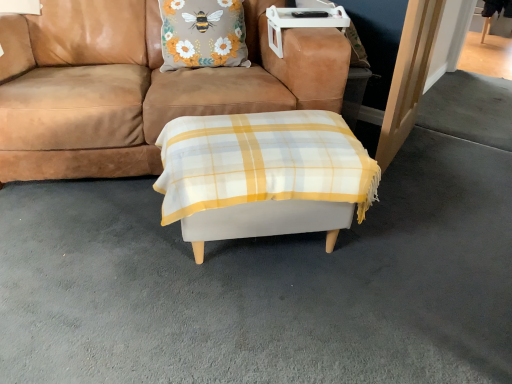
This screenshot has height=384, width=512. Describe the element at coordinates (138, 86) in the screenshot. I see `brown suede couch at center` at that location.

Where is `floral fabric pillow at upper center`? The width and height of the screenshot is (512, 384). floral fabric pillow at upper center is located at coordinates (202, 33).

Describe the element at coordinates (202, 33) in the screenshot. I see `floral fabric pillow at upper center` at that location.

The height and width of the screenshot is (384, 512). Identify the location of brown suede couch at center. (138, 86).

Considering the sizes of objects brown suede couch at center and floral fabric pillow at upper center in the image provided, who is thinner, brown suede couch at center or floral fabric pillow at upper center?

With smaller width is floral fabric pillow at upper center.

Is brown suede couch at center next to floral fabric pillow at upper center?

There is a gap between brown suede couch at center and floral fabric pillow at upper center.

Considering the sizes of brown suede couch at center and floral fabric pillow at upper center in the image, is brown suede couch at center taller or shorter than floral fabric pillow at upper center?

brown suede couch at center is taller than floral fabric pillow at upper center.

Which of these two, brown suede couch at center or white fabric ottoman at center, is bigger?

brown suede couch at center.

Is brown suede couch at center closer to the viewer compared to white fabric ottoman at center?

→ That is False.

Which of these two, brown suede couch at center or white fabric ottoman at center, stands taller?

brown suede couch at center is taller.

From a real-world perspective, is brown suede couch at center over white fabric ottoman at center?

Yes, from a real-world perspective, brown suede couch at center is on top of white fabric ottoman at center.

From the image's perspective, between floral fabric pillow at upper center and brown suede couch at center, which one is located above?

floral fabric pillow at upper center.

Is brown suede couch at center located within floral fabric pillow at upper center?

Actually, brown suede couch at center is outside floral fabric pillow at upper center.

This screenshot has height=384, width=512. Find the location of `pillow above the brown suede couch at center (from a real-world perspective)`. pillow above the brown suede couch at center (from a real-world perspective) is located at coordinates (202, 33).

Is floral fabric pillow at upper center aimed at brown suede couch at center?

Yes, floral fabric pillow at upper center is turned towards brown suede couch at center.

Is point (184, 26) farther from camera compared to point (271, 117)?

Yes, it is behind point (271, 117).

Does floral fabric pillow at upper center touch white fabric ottoman at center?

No, floral fabric pillow at upper center is not making contact with white fabric ottoman at center.

Does floral fabric pillow at upper center have a larger size compared to white fabric ottoman at center?

Actually, floral fabric pillow at upper center might be smaller than white fabric ottoman at center.

Which object is positioned more to the right, floral fabric pillow at upper center or white fabric ottoman at center?

Positioned to the right is white fabric ottoman at center.

Is point (215, 126) in front of point (187, 10)?

Yes, point (215, 126) is closer to viewer.

Is white fabric ottoman at center in contact with floral fabric pillow at upper center?

No, white fabric ottoman at center is not with floral fabric pillow at upper center.

Where is `table below the floral fabric pillow at upper center (from a real-world perspective)`? The width and height of the screenshot is (512, 384). table below the floral fabric pillow at upper center (from a real-world perspective) is located at coordinates (263, 176).

Is brown suede couch at center a part of white fabric ottoman at center?

No, white fabric ottoman at center does not contain brown suede couch at center.

This screenshot has width=512, height=384. There is a white fabric ottoman at center. Identify the location of studio couch above it (from a real-world perspective). (138, 86).

From a real-world perspective, who is located higher, white fabric ottoman at center or brown suede couch at center?

brown suede couch at center, from a real-world perspective.

Between white fabric ottoman at center and brown suede couch at center, which one has larger width?

With larger width is brown suede couch at center.

I want to click on studio couch to the left of floral fabric pillow at upper center, so click(x=138, y=86).

Image resolution: width=512 pixels, height=384 pixels. I want to click on studio couch behind the white fabric ottoman at center, so click(138, 86).

Which object lies further to the anchor point white fabric ottoman at center, brown suede couch at center or floral fabric pillow at upper center?

floral fabric pillow at upper center is positioned further to the anchor white fabric ottoman at center.

When comparing their distances from floral fabric pillow at upper center, does white fabric ottoman at center or brown suede couch at center seem further?

white fabric ottoman at center is positioned further to the anchor floral fabric pillow at upper center.

Based on their spatial positions, is brown suede couch at center or white fabric ottoman at center closer to floral fabric pillow at upper center?

brown suede couch at center is positioned closer to the anchor floral fabric pillow at upper center.

Considering their positions, is floral fabric pillow at upper center positioned closer to white fabric ottoman at center than brown suede couch at center?

Based on the image, brown suede couch at center appears to be nearer to white fabric ottoman at center.

When comparing their distances from brown suede couch at center, does white fabric ottoman at center or floral fabric pillow at upper center seem closer?

The object closer to brown suede couch at center is floral fabric pillow at upper center.

Based on the photo, considering their positions, is floral fabric pillow at upper center positioned further to brown suede couch at center than white fabric ottoman at center?

white fabric ottoman at center is positioned further to the anchor brown suede couch at center.

Where is `studio couch located between white fabric ottoman at center and floral fabric pillow at upper center in the depth direction`? The image size is (512, 384). studio couch located between white fabric ottoman at center and floral fabric pillow at upper center in the depth direction is located at coordinates (138, 86).